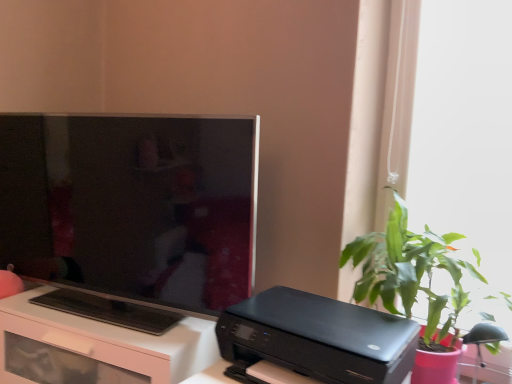
The image size is (512, 384). Find the location of `free point below matte black tv at left (from a real-world perspective)`. free point below matte black tv at left (from a real-world perspective) is located at coordinates (102, 309).